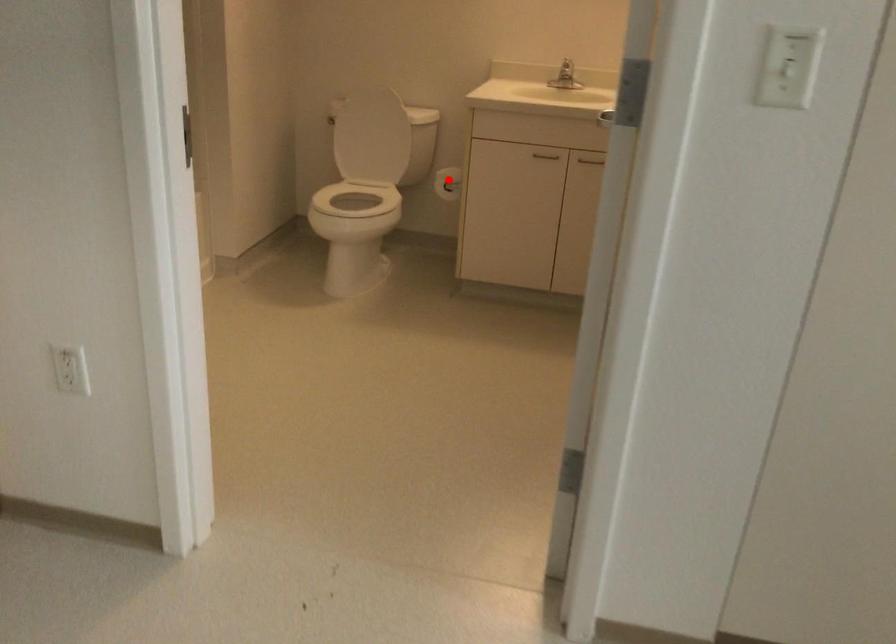
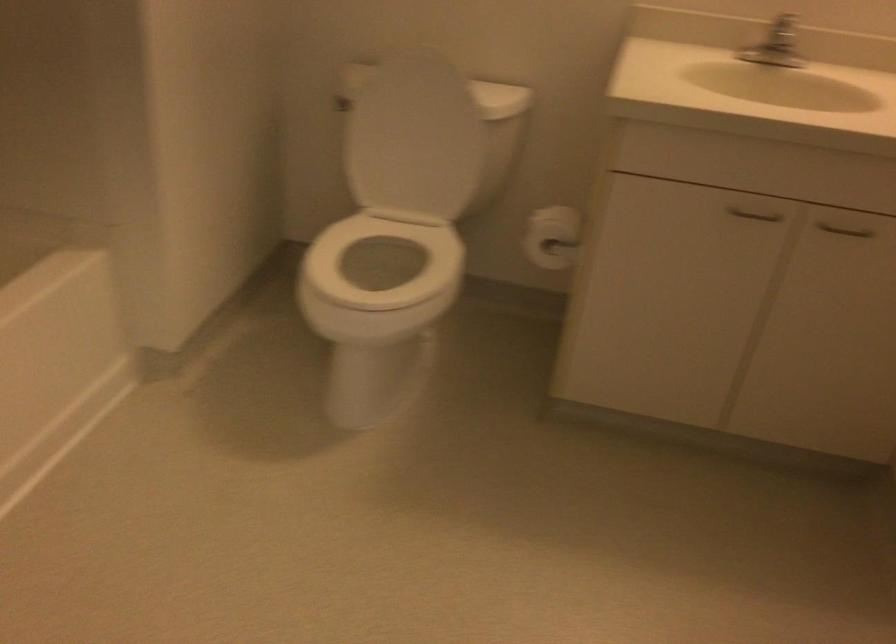
The point at the highlighted location is marked in the first image. Where is the corresponding point in the second image?

(552, 237)